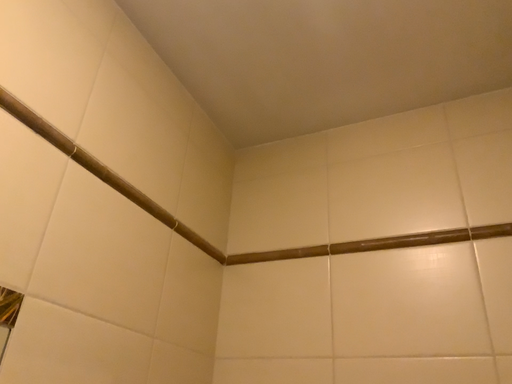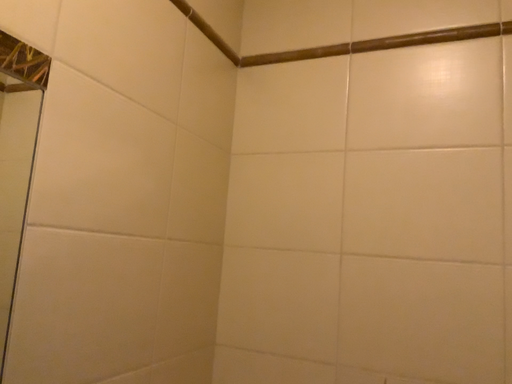
Question: Which way did the camera rotate in the video?

Choices:
 (A) rotated upward
 (B) rotated downward

Answer: (B)